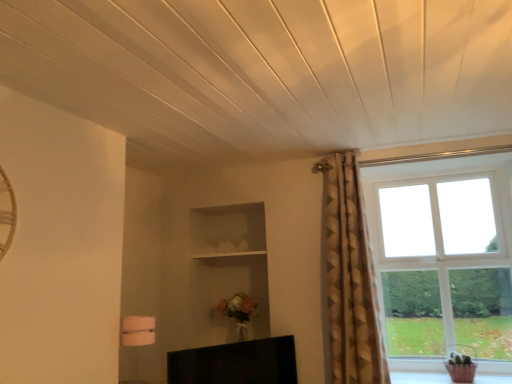
Question: From a real-world perspective, is gold textured curtain at upper right over black glossy tv at lower center?

Choices:
 (A) yes
 (B) no

Answer: (A)

Question: Does gold textured curtain at upper right turn towards black glossy tv at lower center?

Choices:
 (A) yes
 (B) no

Answer: (B)

Question: From the image's perspective, is gold textured curtain at upper right above black glossy tv at lower center?

Choices:
 (A) yes
 (B) no

Answer: (A)

Question: Is gold textured curtain at upper right bigger than black glossy tv at lower center?

Choices:
 (A) yes
 (B) no

Answer: (A)

Question: Is there a large distance between gold textured curtain at upper right and black glossy tv at lower center?

Choices:
 (A) yes
 (B) no

Answer: (B)

Question: From a real-world perspective, is gold textured curtain at upper right located beneath black glossy tv at lower center?

Choices:
 (A) no
 (B) yes

Answer: (A)

Question: Is white wooden shelf at center to the left of black glossy tv at lower center from the viewer's perspective?

Choices:
 (A) yes
 (B) no

Answer: (A)

Question: Is white wooden shelf at center shorter than black glossy tv at lower center?

Choices:
 (A) no
 (B) yes

Answer: (B)

Question: Is black glossy tv at lower center at the back of white wooden shelf at center?

Choices:
 (A) yes
 (B) no

Answer: (B)

Question: Considering the relative positions of white wooden shelf at center and black glossy tv at lower center in the image provided, is white wooden shelf at center behind black glossy tv at lower center?

Choices:
 (A) yes
 (B) no

Answer: (A)

Question: From a real-world perspective, is white wooden shelf at center on top of black glossy tv at lower center?

Choices:
 (A) yes
 (B) no

Answer: (A)

Question: Can black glossy tv at lower center be found inside white wooden shelf at center?

Choices:
 (A) yes
 (B) no

Answer: (B)

Question: From a real-world perspective, is clear glass window at right beneath black glossy tv at lower center?

Choices:
 (A) no
 (B) yes

Answer: (A)